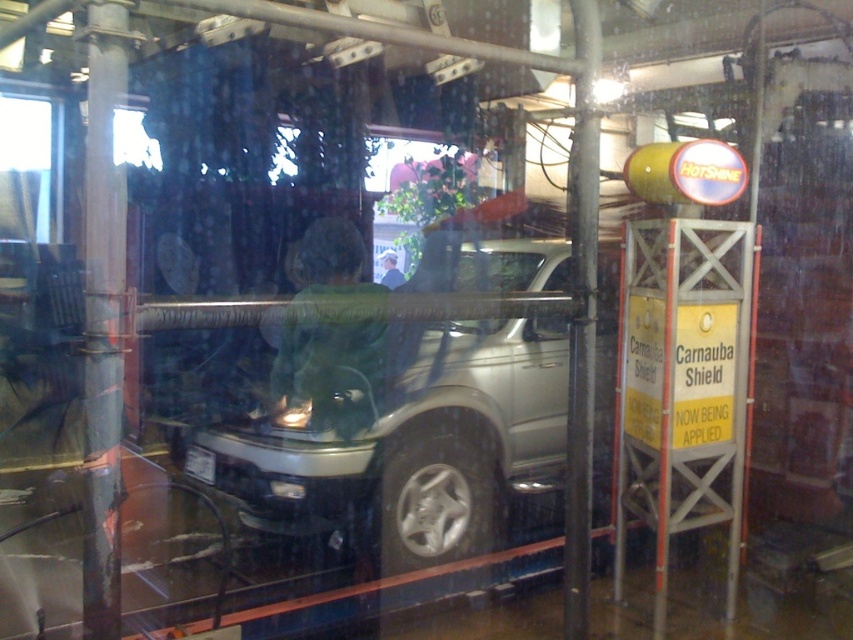
Is clear glass window at center smaller than green fabric jacket at center?

No.

This screenshot has height=640, width=853. Describe the element at coordinates (496, 266) in the screenshot. I see `clear glass window at center` at that location.

This screenshot has width=853, height=640. I want to click on clear glass window at center, so click(x=496, y=266).

Can you confirm if satin silver vehicle at center is thinner than clear glass window at center?

Incorrect, satin silver vehicle at center's width is not less than clear glass window at center's.

Between point (564, 248) and point (485, 259), which one is positioned in front?

Point (564, 248) is more forward.

At what (x,y) coordinates should I click in order to perform the action: click on satin silver vehicle at center. Please return your answer as a coordinate pair (x, y). Looking at the image, I should click on (410, 445).

Is green fabric shirt at center thinner than green fabric jacket at center?

In fact, green fabric shirt at center might be wider than green fabric jacket at center.

Where is `green fabric shirt at center`? green fabric shirt at center is located at coordinates (331, 371).

Image resolution: width=853 pixels, height=640 pixels. Identify the location of green fabric shirt at center. 331,371.